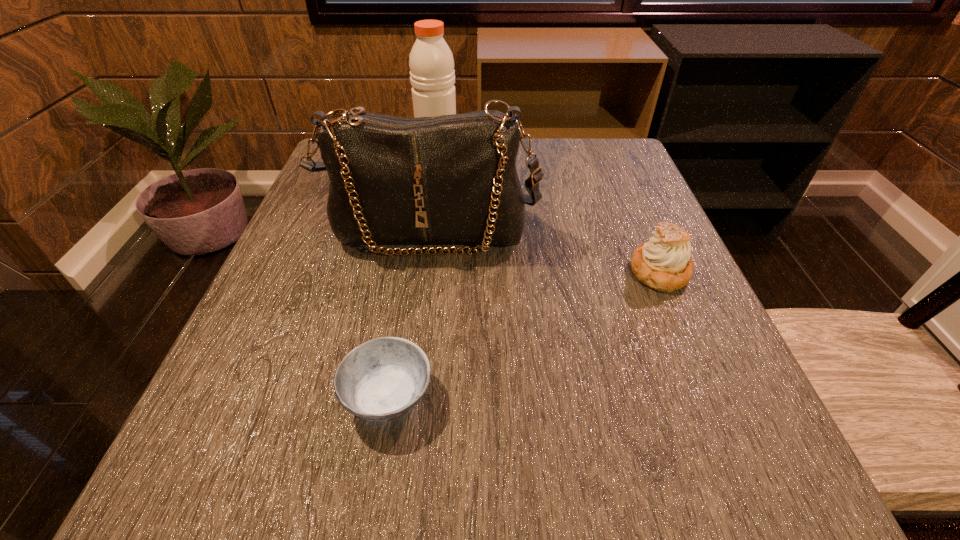
At what (x,y) coordinates should I click in order to perform the action: click on free location that satisfies the following two spatial constraints: 1. at the front of the handbag with chain and zipper; 2. on the right side of the third tallest object. Please return your answer as a coordinate pair (x, y). Looking at the image, I should click on (424, 272).

Find the location of `free space that satisfies the following two spatial constraints: 1. on the front side of the shaker; 2. on the right side of the rightmost object`. free space that satisfies the following two spatial constraints: 1. on the front side of the shaker; 2. on the right side of the rightmost object is located at coordinates (421, 272).

Identify the location of free point that satisfies the following two spatial constraints: 1. on the back side of the pastry; 2. on the left side of the ashtray. The image size is (960, 540). tap(410, 272).